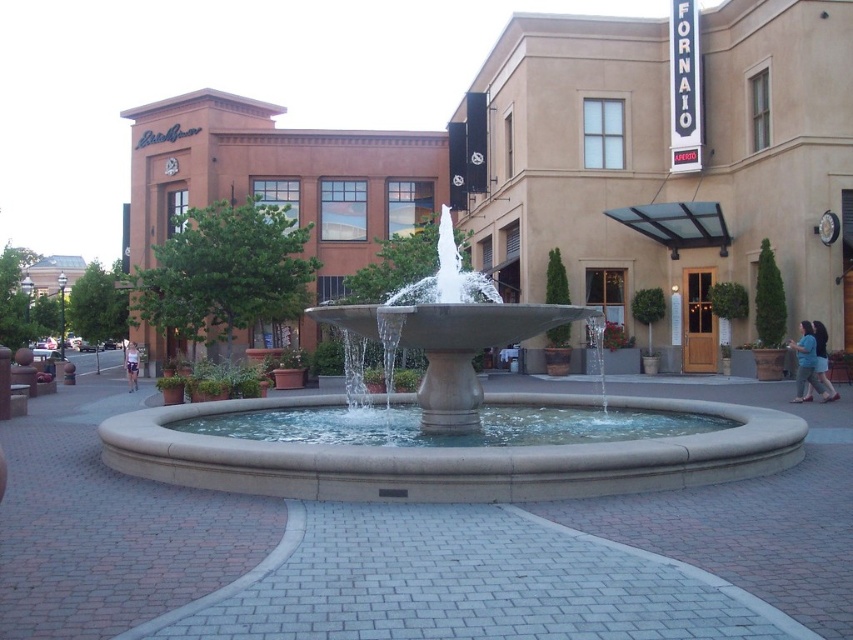
You are standing at the edge of the plaza facing the fountain. You see a person wearing a blue cotton shirt at lower right and denim shorts at center. Which clothing item is positioned more to your right?

The blue cotton shirt at lower right is positioned more to the right compared to the denim shorts at center.

You are standing in the plaza and want to take a photo of the smooth concrete fountain at center and the blue cotton shirt at lower right. Which object should you focus on first to ensure both are in the frame?

You should focus on the smooth concrete fountain at center first because it is closer to you than the blue cotton shirt at lower right, ensuring both are in the frame.

You are standing at the edge of the plaza and notice the smooth concrete fountain at center and the denim shorts at center. Which object is narrower in width?

The smooth concrete fountain at center is thinner than the denim shorts at center, so the smooth concrete fountain at center is narrower in width.